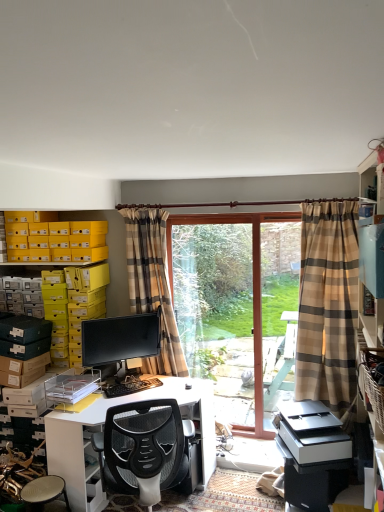
Locate an element on the screen. The width and height of the screenshot is (384, 512). yellow cardboard box at upper left is located at coordinates (57, 241).

This screenshot has width=384, height=512. What do you see at coordinates (312, 432) in the screenshot?
I see `white plastic printer at center` at bounding box center [312, 432].

In order to face plaid fabric curtain at center, which is counted as the second curtain, starting from the right, should I rotate leftwards or rightwards?

To align with it, rotate left about 5.329°.

The image size is (384, 512). Describe the element at coordinates (235, 307) in the screenshot. I see `clear glass door at center` at that location.

Locate an element on the screen. This screenshot has height=512, width=384. yellow cardboard box at upper left is located at coordinates (57, 241).

Is point (211, 457) closer or farther from the camera than point (94, 341)?

Point (211, 457) appears to be closer to the viewer than point (94, 341).

Which of these two, white glossy computer desk at center or matte black monitor at center, is bigger?

Bigger between the two is white glossy computer desk at center.

Is matte black monitor at center at the back of white glossy computer desk at center?

white glossy computer desk at center does not have its back to matte black monitor at center.

Can you tell me how much clear glass door at center and black plastic keyboard at center differ in facing direction?

The angle between the facing direction of clear glass door at center and the facing direction of black plastic keyboard at center is 43.5 degrees.

From the image's perspective, who appears lower, clear glass door at center or black plastic keyboard at center?

From the image's view, black plastic keyboard at center is below.

Is the depth of clear glass door at center less than that of black plastic keyboard at center?

That is False.

Locate an element on the screen. The width and height of the screenshot is (384, 512). screen door on the right of the white glossy computer desk at center is located at coordinates (273, 305).

Looking at this image, between clear glass screen door at center and white glossy computer desk at center, which one appears on the right side from the viewer's perspective?

From the viewer's perspective, clear glass screen door at center appears more on the right side.

Is clear glass screen door at center further to camera compared to white glossy computer desk at center?

Yes, clear glass screen door at center is further from the camera.

Can you tell me how much plaid fabric curtain at right, which is the 2th curtain in left-to-right order, and white glossy computer desk at center differ in facing direction?

There is a 6.25-degree angle between the facing directions of plaid fabric curtain at right, which is the 2th curtain in left-to-right order, and white glossy computer desk at center.

Looking at this image, is plaid fabric curtain at right, acting as the first curtain starting from the right, taller than white glossy computer desk at center?

Yes.

From the white glossy computer desk at center, count 1st curtains backward and point to it. Please provide its 2D coordinates.

[(328, 304)]

Would you say plaid fabric curtain at center, which is counted as the second curtain, starting from the right, is inside or outside matte black monitor at center?

plaid fabric curtain at center, which is counted as the second curtain, starting from the right, lies outside matte black monitor at center.

Is plaid fabric curtain at center, which ranks as the 2th curtain in front-to-back order, looking in the opposite direction of matte black monitor at center?

No, plaid fabric curtain at center, which ranks as the 2th curtain in front-to-back order, is not facing away from matte black monitor at center.

Considering the relative sizes of plaid fabric curtain at center, which is the first curtain in left-to-right order, and matte black monitor at center in the image provided, is plaid fabric curtain at center, which is the first curtain in left-to-right order, thinner than matte black monitor at center?

No.

In the image, there is a clear glass door at center. At what (x,y) coordinates should I click in order to perform the action: click on printer below it (from a real-world perspective). Please return your answer as a coordinate pair (x, y). Looking at the image, I should click on 312,432.

From a real-world perspective, does white plastic printer at center sit lower than clear glass door at center?

Yes, from a real-world perspective, white plastic printer at center is below clear glass door at center.

Does white plastic printer at center have a greater width compared to clear glass door at center?

Correct, the width of white plastic printer at center exceeds that of clear glass door at center.

Based on their sizes in the image, would you say white glossy computer desk at center is bigger or smaller than clear glass door at center?

Considering their sizes, white glossy computer desk at center takes up more space than clear glass door at center.

Is white glossy computer desk at center looking in the opposite direction of clear glass door at center?

Yes, white glossy computer desk at center is facing away from clear glass door at center.

From the image's perspective, does white glossy computer desk at center appear lower than clear glass door at center?

Indeed, from the image's perspective, white glossy computer desk at center is shown beneath clear glass door at center.

Where is `computer desk that appears in front of the matte black monitor at center`? computer desk that appears in front of the matte black monitor at center is located at coordinates (102, 430).

Locate an element on the screen. bay window above the black plastic keyboard at center (from the image's perspective) is located at coordinates (235, 307).

Looking at the image, which one is located further to black plastic keyboard at center, plaid fabric curtain at center, which is the first curtain in left-to-right order, or yellow cardboard box at upper left?

Based on the image, yellow cardboard box at upper left appears to be further to black plastic keyboard at center.

Considering their positions, is clear glass door at center positioned closer to white plastic printer at center than white glossy computer desk at center?

Among the two, white glossy computer desk at center is located nearer to white plastic printer at center.

Considering their positions, is white plastic printer at center positioned further to yellow cardboard box at upper left than clear glass door at center?

Based on the image, white plastic printer at center appears to be further to yellow cardboard box at upper left.

Which object lies further to the anchor point white glossy computer desk at center, white plastic printer at center or yellow cardboard box at upper left?

yellow cardboard box at upper left is positioned further to the anchor white glossy computer desk at center.

Estimate the real-world distances between objects in this image. Which object is closer to plaid fabric curtain at center, acting as the 1th curtain starting from the back, plaid fabric curtain at right, the 2th curtain when ordered from back to front, or white glossy computer desk at center?

white glossy computer desk at center is positioned closer to the anchor plaid fabric curtain at center, acting as the 1th curtain starting from the back.

Estimate the real-world distances between objects in this image. Which object is closer to black plastic keyboard at center, clear glass screen door at center or white glossy computer desk at center?

white glossy computer desk at center.

Which object lies further to the anchor point yellow cardboard box at upper left, black plastic keyboard at center or plaid fabric curtain at center, which ranks as the 2th curtain in front-to-back order?

black plastic keyboard at center is positioned further to the anchor yellow cardboard box at upper left.

When comparing their distances from clear glass door at center, does plaid fabric curtain at right, the 2th curtain when ordered from back to front, or white glossy computer desk at center seem further?

white glossy computer desk at center is positioned further to the anchor clear glass door at center.

The height and width of the screenshot is (512, 384). Identify the location of computer keyboard between plaid fabric curtain at center, which ranks as the 2th curtain in front-to-back order, and white glossy computer desk at center from top to bottom. (130, 386).

The width and height of the screenshot is (384, 512). Identify the location of computer monitor between yellow cardboard box at upper left and white glossy computer desk at center from top to bottom. (120, 339).

Where is `screen door between black plastic keyboard at center and plaid fabric curtain at right, which is the 2th curtain in left-to-right order`? screen door between black plastic keyboard at center and plaid fabric curtain at right, which is the 2th curtain in left-to-right order is located at coordinates (273, 305).

Find the location of a particular element. printer situated between matte black monitor at center and plaid fabric curtain at right, which is the 2th curtain in left-to-right order, from left to right is located at coordinates (312, 432).